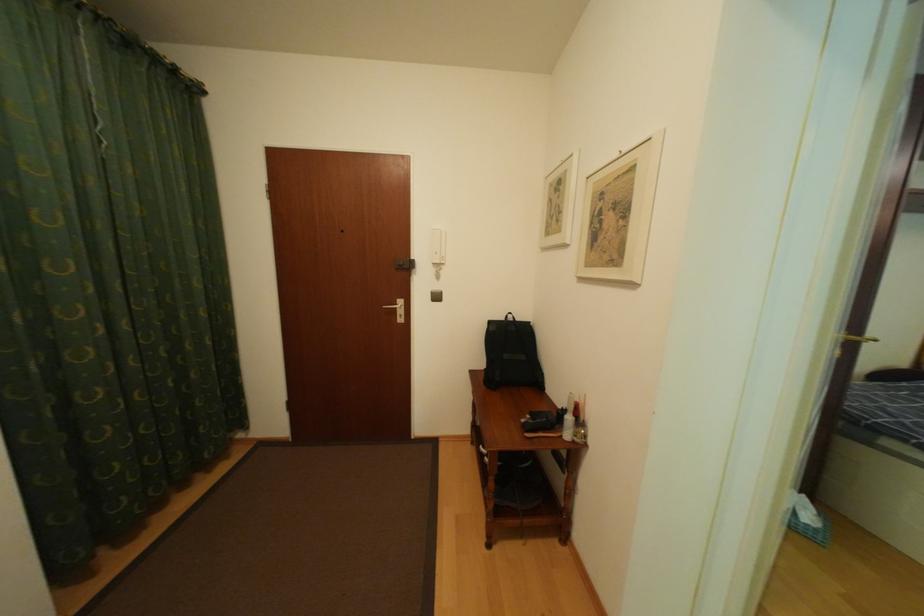
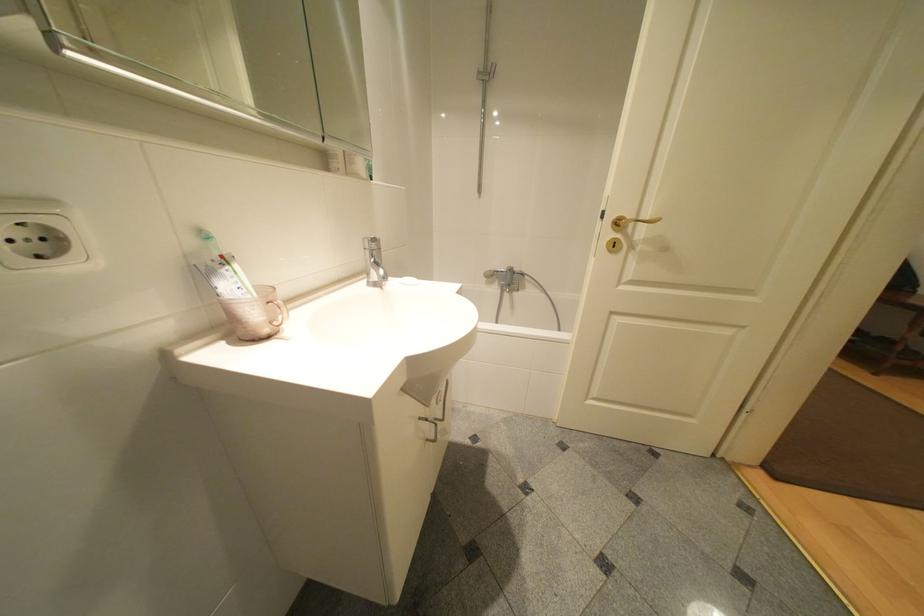
Consider the image. Which direction would the cameraman need to move to produce the second image?

The cameraman walked toward left, backward.